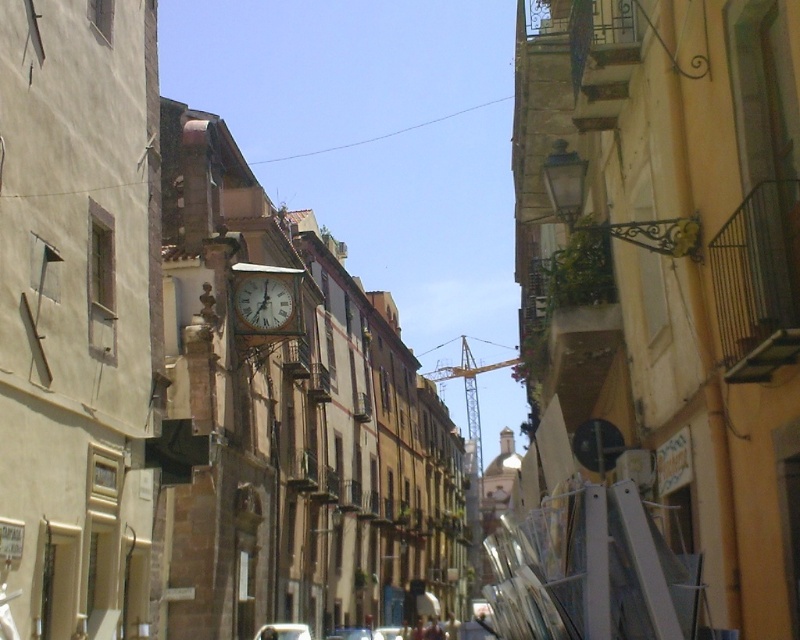
You are a delivery person trying to navigate a narrow street in a historic town. You see a wooden clock at center and a metallic silver car at center. Can you determine which object is narrower so you can plan your route?

The wooden clock at center is thinner than the metallic silver car at center, so the wooden clock at center is narrower and you can plan your route around it accordingly.